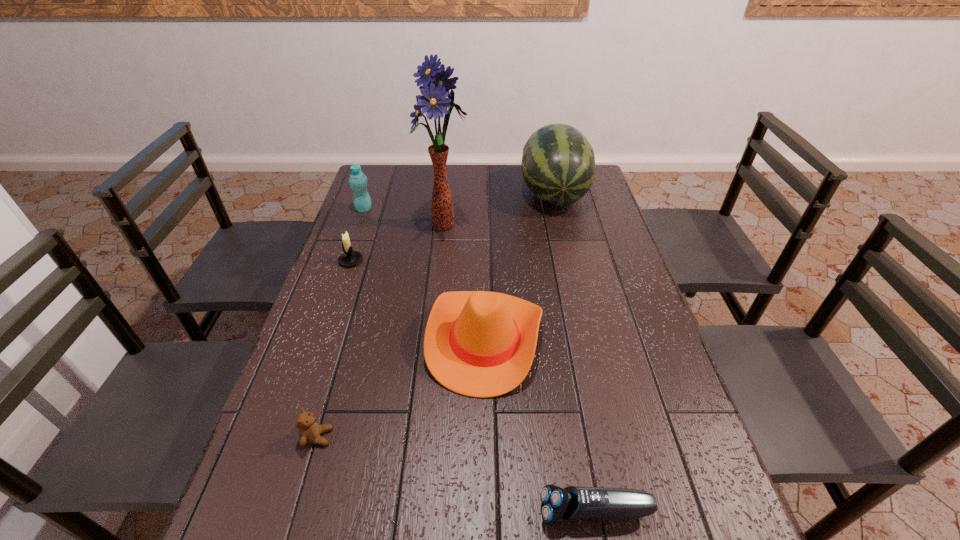
What are the coordinates of `free spot between the fifth farthest object and the candle holder` in the screenshot? It's located at (418, 300).

Find the location of a particular element. The image size is (960, 540). free space between the sixth farthest object and the nearest object is located at coordinates (456, 475).

This screenshot has width=960, height=540. Find the location of `free point between the third shortest object and the bottle`. free point between the third shortest object and the bottle is located at coordinates (357, 235).

What are the coordinates of `blank region between the bottle and the second nearest object` in the screenshot? It's located at (341, 323).

You are a GUI agent. You are given a task and a screenshot of the screen. Output one action in this format:
    pyautogui.click(x=<x>, y=<y>)
    Task: Click on the free space between the tallest object and the watermelon
    The height and width of the screenshot is (540, 960).
    Given the screenshot: What is the action you would take?
    pyautogui.click(x=499, y=210)

The width and height of the screenshot is (960, 540). In order to click on blank region between the bottle and the watermelon in this screenshot , I will do `click(459, 202)`.

Identify which object is the nearest to the tallest object. Please provide its 2D coordinates. Your answer should be formatted as a tuple, i.e. [(x, y)], where the tuple contains the x and y coordinates of a point satisfying the conditions above.

[(349, 258)]

You are a GUI agent. You are given a task and a screenshot of the screen. Output one action in this format:
    pyautogui.click(x=<x>, y=<y>)
    Task: Click on the second closest object to the fifth tallest object
    Image resolution: width=960 pixels, height=540 pixels.
    Given the screenshot: What is the action you would take?
    pyautogui.click(x=358, y=181)

Find the location of a particular element. This screenshot has width=960, height=540. free location that satisfies the following two spatial constraints: 1. on the back side of the second tallest object; 2. on the left side of the fourth nearest object is located at coordinates pyautogui.click(x=373, y=194).